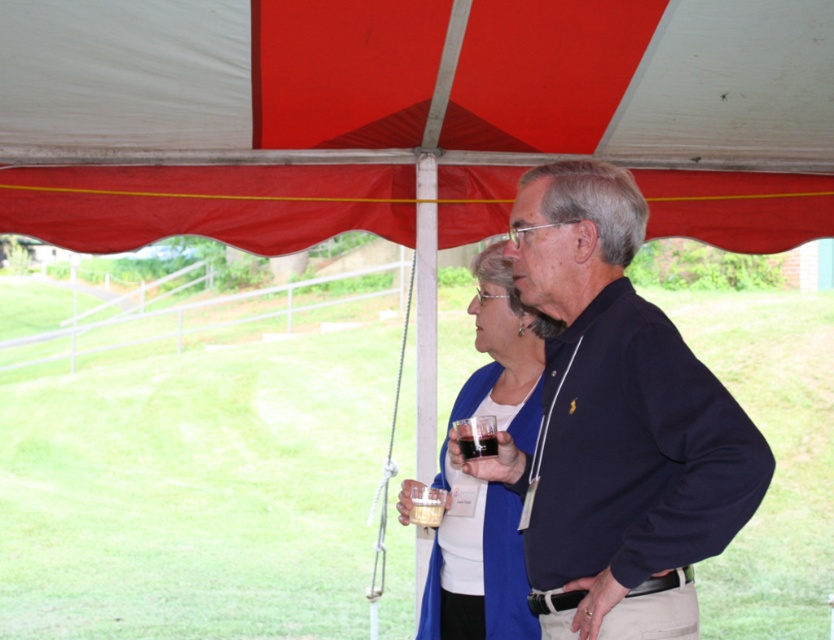
Can you confirm if red fabric canopy at upper center is taller than blue fabric sweater at center?

No, red fabric canopy at upper center is not taller than blue fabric sweater at center.

Can you confirm if red fabric canopy at upper center is positioned to the right of blue fabric sweater at center?

No, red fabric canopy at upper center is not to the right of blue fabric sweater at center.

Is point (398, 195) less distant than point (485, 506)?

No, (398, 195) is behind (485, 506).

What are the coordinates of `red fabric canopy at upper center` in the screenshot? It's located at (215, 80).

Between red fabric canopy at upper center and dark blue sweater at center, which one is positioned higher?

red fabric canopy at upper center is above.

Is red fabric canopy at upper center above dark blue sweater at center?

A: Yes, red fabric canopy at upper center is above dark blue sweater at center.

Identify the location of red fabric canopy at upper center. The image size is (834, 640). (215, 80).

Does translucent glass at upper center have a lesser width compared to translucent plastic cup at lower center?

Yes, translucent glass at upper center is thinner than translucent plastic cup at lower center.

Who is shorter, translucent glass at upper center or translucent plastic cup at lower center?

With less height is translucent glass at upper center.

The width and height of the screenshot is (834, 640). What are the coordinates of `translucent glass at upper center` in the screenshot? It's located at (476, 440).